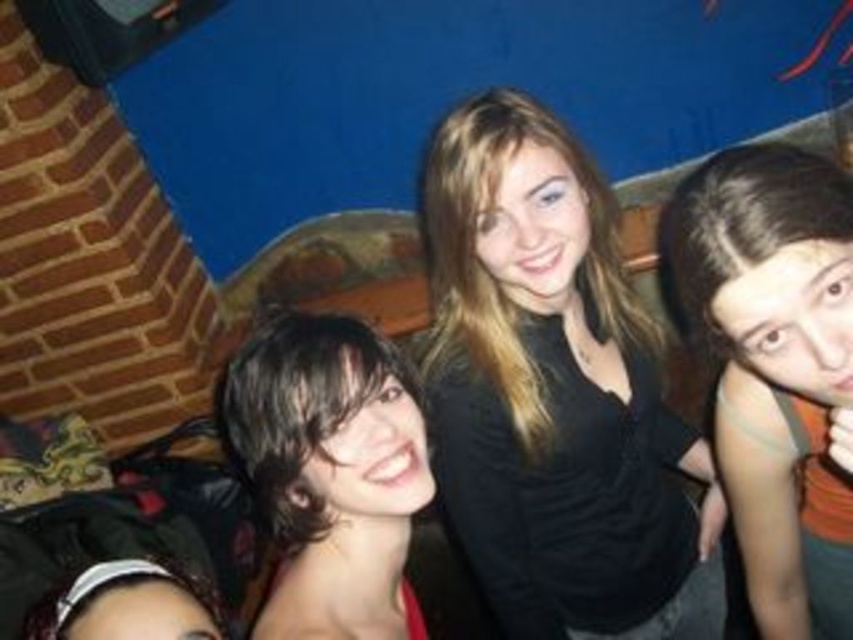
Question: Does black matte shirt at center come behind matte black hair at lower left?

Choices:
 (A) yes
 (B) no

Answer: (A)

Question: Does black matte shirt at center have a larger size compared to dark brown hair at center?

Choices:
 (A) no
 (B) yes

Answer: (B)

Question: Among these objects, which one is farthest from the camera?

Choices:
 (A) black matte shirt at center
 (B) dark brown hair at right

Answer: (A)

Question: Among these objects, which one is farthest from the camera?

Choices:
 (A) dark brown hair at center
 (B) dark brown hair at right

Answer: (A)

Question: Which of the following is the farthest from the observer?

Choices:
 (A) matte black hair at lower left
 (B) dark brown hair at center
 (C) black matte shirt at center

Answer: (C)

Question: Can you confirm if black matte shirt at center is positioned to the right of matte black hair at lower left?

Choices:
 (A) no
 (B) yes

Answer: (B)